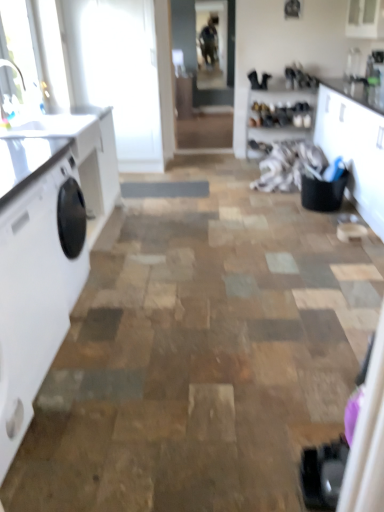
Locate an element on the screen. This screenshot has height=512, width=384. white glossy cabinet at right is located at coordinates (354, 146).

This screenshot has width=384, height=512. I want to click on clear glass window screen at upper center, so click(212, 42).

Image resolution: width=384 pixels, height=512 pixels. Describe the element at coordinates (212, 42) in the screenshot. I see `clear glass window screen at upper center` at that location.

You are a GUI agent. You are given a task and a screenshot of the screen. Output one action in this format:
    pyautogui.click(x=<x>, y=<y>)
    Task: Click on the white glossy countertop at left
    This screenshot has width=384, height=512.
    Given the screenshot: What is the action you would take?
    pyautogui.click(x=83, y=156)

From their relative heights in the image, would you say white glossy countertop at left is taller or shorter than white glossy cabinet at right?

Considering their sizes, white glossy countertop at left has less height than white glossy cabinet at right.

From a real-world perspective, which is physically above, white glossy countertop at left or white glossy cabinet at right?

white glossy countertop at left, from a real-world perspective.

Would you say white glossy countertop at left is outside white glossy cabinet at right?

Yes, white glossy countertop at left is outside of white glossy cabinet at right.

Does white glossy countertop at left have a smaller size compared to white glossy cabinet at right?

Indeed, white glossy countertop at left has a smaller size compared to white glossy cabinet at right.

Which of these two, white fabric at center or clear glass window screen at upper center, stands taller?

clear glass window screen at upper center is taller.

This screenshot has width=384, height=512. I want to click on laundry below the clear glass window screen at upper center (from the image's perspective), so click(289, 166).

Measure the distance between white fabric at center and clear glass window screen at upper center.

white fabric at center is 11.52 feet from clear glass window screen at upper center.

From the image's perspective, between white fabric at center and clear glass window screen at upper center, who is located below?

From the image's view, white fabric at center is below.

Who is more distant, white glossy countertop at left or white glossy countertop at left?

white glossy countertop at left.

Between white glossy countertop at left and white glossy countertop at left, which one appears on the left side from the viewer's perspective?

From the viewer's perspective, white glossy countertop at left appears more on the left side.

This screenshot has width=384, height=512. In order to click on counter top above the white glossy countertop at left (from a real-world perspective) in this screenshot , I will do `click(26, 161)`.

Is white glossy countertop at left beside white glossy countertop at left?

No, white glossy countertop at left is not making contact with white glossy countertop at left.

Is white glossy countertop at left to the left of white glossy washing machine at left from the viewer's perspective?

Yes.

Can you confirm if white glossy countertop at left is shorter than white glossy washing machine at left?

Indeed, white glossy countertop at left has a lesser height compared to white glossy washing machine at left.

From the image's perspective, is white glossy countertop at left above or below white glossy washing machine at left?

white glossy countertop at left is above white glossy washing machine at left.

Are white glossy countertop at left and white glossy washing machine at left far apart?

No, there isn't a large distance between white glossy countertop at left and white glossy washing machine at left.

From the picture: Considering the relative positions of white glossy washing machine at left and white glossy countertop at left in the image provided, is white glossy washing machine at left to the left of white glossy countertop at left from the viewer's perspective?

No, white glossy washing machine at left is not to the left of white glossy countertop at left.

Measure the distance between white glossy washing machine at left and white glossy countertop at left.

They are 16.66 inches apart.

How many degrees apart are the facing directions of white glossy washing machine at left and white glossy countertop at left?

They differ by 0.000436 degrees in their facing directions.

Could white glossy countertop at left be considered to be inside white glossy washing machine at left?

No, white glossy countertop at left is not surrounded by white glossy washing machine at left.

Can you confirm if white fabric at center is thinner than white glossy cabinet at right?

No.

Does white fabric at center lie in front of white glossy cabinet at right?

No, it is not.

Can you tell me how much white fabric at center and white glossy cabinet at right differ in facing direction?

1.22 degrees.

From a real-world perspective, who is located lower, white fabric at center or white glossy cabinet at right?

From a 3D spatial view, white fabric at center is below.

Is white glossy countertop at left inside clear glass window screen at upper center?

Actually, white glossy countertop at left is outside clear glass window screen at upper center.

Where is `window screen that appears above the white glossy countertop at left (from a real-world perspective)`? window screen that appears above the white glossy countertop at left (from a real-world perspective) is located at coordinates (212, 42).

Consider the image. Is white glossy countertop at left at the back of clear glass window screen at upper center?

clear glass window screen at upper center is not turned away from white glossy countertop at left.

Does point (204, 12) appear closer or farther from the camera than point (35, 143)?

Point (204, 12) appears to be farther away from the viewer than point (35, 143).

In the image, there is a white glossy cabinet at right. At what (x,y) coordinates should I click in order to perform the action: click on counter top below it (from the image's perspective). Please return your answer as a coordinate pair (x, y). Looking at the image, I should click on (26, 161).

The height and width of the screenshot is (512, 384). In the image, there is a clear glass window screen at upper center. What are the coordinates of `laundry below it (from a real-world perspective)` in the screenshot? It's located at (289, 166).

From the image, which object appears to be nearer to white glossy washing machine at left, white glossy countertop at left or white glossy cabinet at right?

The object closer to white glossy washing machine at left is white glossy countertop at left.

Based on the photo, considering their positions, is white glossy washing machine at left positioned further to white glossy countertop at left than white glossy cabinet at right?

white glossy cabinet at right.

When comparing their distances from white glossy countertop at left, does white glossy cabinet at right or clear glass window screen at upper center seem closer?

white glossy cabinet at right is positioned closer to the anchor white glossy countertop at left.

When comparing their distances from clear glass window screen at upper center, does white fabric at center or white glossy countertop at left seem closer?

white fabric at center is closer to clear glass window screen at upper center.

When comparing their distances from clear glass window screen at upper center, does white glossy cabinet at right or white glossy countertop at left seem closer?

white glossy cabinet at right is closer to clear glass window screen at upper center.

Which object lies nearer to the anchor point white glossy washing machine at left, white fabric at center or white glossy cabinet at right?

Among the two, white glossy cabinet at right is located nearer to white glossy washing machine at left.

Looking at this image, looking at the image, which one is located further to white glossy washing machine at left, white glossy countertop at left or white fabric at center?

The object further to white glossy washing machine at left is white fabric at center.

Based on their spatial positions, is white fabric at center or clear glass window screen at upper center closer to white glossy countertop at left?

white fabric at center is closer to white glossy countertop at left.

You are a GUI agent. You are given a task and a screenshot of the screen. Output one action in this format:
    pyautogui.click(x=<x>, y=<y>)
    Task: Click on the laundry between white glossy countertop at left and white glossy cabinet at right in the horizontal direction
    This screenshot has width=384, height=512.
    Given the screenshot: What is the action you would take?
    pyautogui.click(x=289, y=166)

Where is `countertop between white glossy washing machine at left and clear glass window screen at upper center along the z-axis`? countertop between white glossy washing machine at left and clear glass window screen at upper center along the z-axis is located at coordinates (83, 156).

Image resolution: width=384 pixels, height=512 pixels. Find the location of `laundry between white glossy washing machine at left and clear glass window screen at upper center from front to back`. laundry between white glossy washing machine at left and clear glass window screen at upper center from front to back is located at coordinates (289, 166).

The width and height of the screenshot is (384, 512). In order to click on counter top between white glossy countertop at left and white glossy cabinet at right from left to right in this screenshot , I will do `click(26, 161)`.